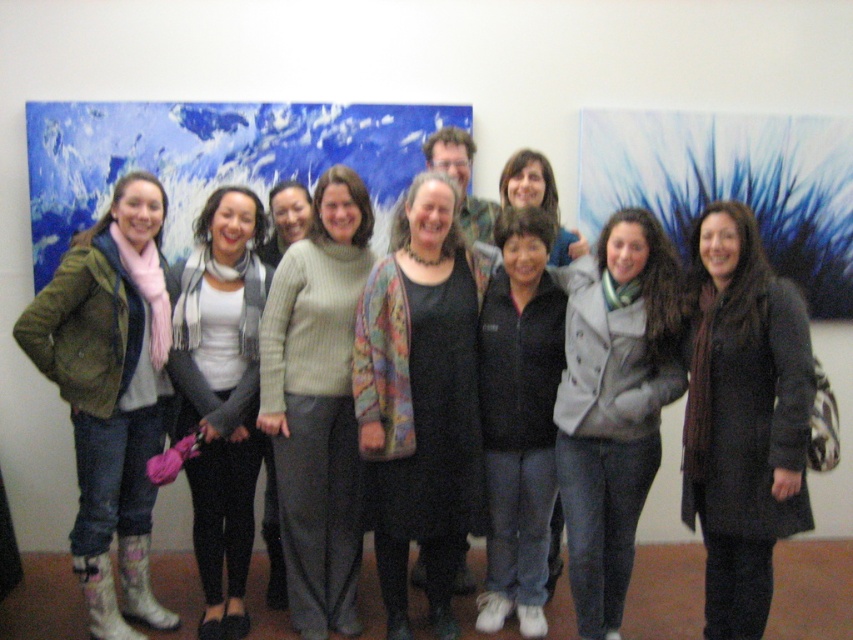
Question: Which object is positioned farthest from the gray wool coat at center?

Choices:
 (A) light green sweater at center
 (B) white soft scarf at center
 (C) knit sweater at center

Answer: (A)

Question: Can you confirm if multicolored knitted cardigan at center is wider than matte green jacket at left?

Choices:
 (A) yes
 (B) no

Answer: (A)

Question: Which point appears closest to the camera in this image?

Choices:
 (A) (263, 262)
 (B) (561, 316)
 (C) (99, 628)
 (D) (335, 440)

Answer: (B)

Question: Does dark brown coat at center have a smaller size compared to matte green jacket at left?

Choices:
 (A) yes
 (B) no

Answer: (A)

Question: Does multicolored knitted cardigan at center lie behind gray wool coat at center?

Choices:
 (A) yes
 (B) no

Answer: (A)

Question: Which of the following is the farthest from the observer?

Choices:
 (A) matte green jacket at left
 (B) light green sweater at center
 (C) knit sweater at center

Answer: (B)